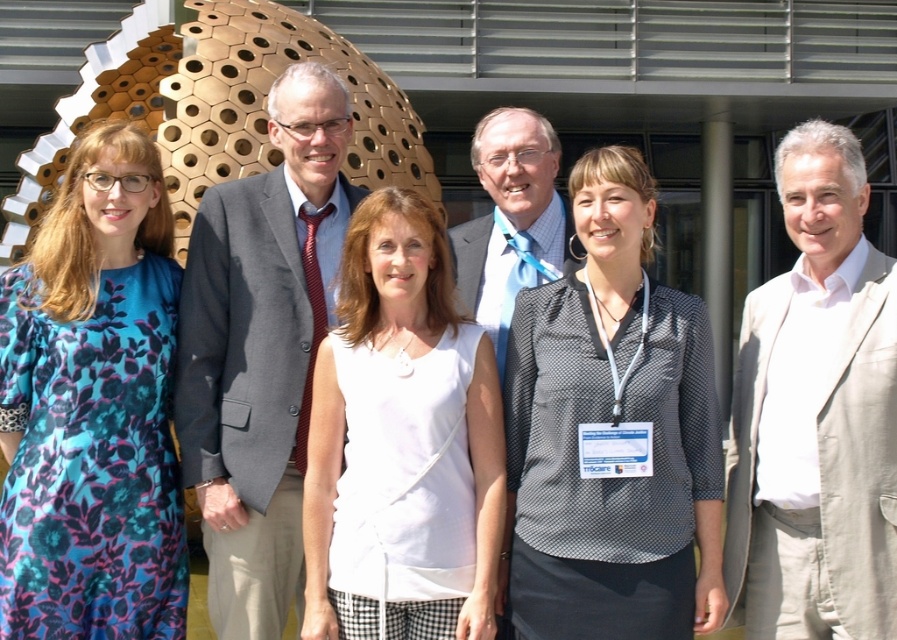
Can you confirm if polka dot blouse at center is positioned below light beige suit at center?

Yes.

Between polka dot blouse at center and light beige suit at center, which one is positioned higher?

light beige suit at center is higher up.

Is point (634, 605) more distant than point (873, 596)?

Yes, it is behind point (873, 596).

At what (x,y) coordinates should I click in order to perform the action: click on polka dot blouse at center. Please return your answer as a coordinate pair (x, y). This screenshot has height=640, width=897. Looking at the image, I should click on (610, 435).

Does point (366, 403) come farther from viewer compared to point (475, 262)?

No, it is not.

Find the location of a particular element. The image size is (897, 640). white fabric shirt at center is located at coordinates (402, 429).

Which is below, blue floral dress at left or light blue fabric at center?

blue floral dress at left is below.

Who is more distant from viewer, (84, 397) or (451, 237)?

Point (451, 237)

Which is in front, point (122, 248) or point (501, 262)?

Point (122, 248)

You are a GUI agent. You are given a task and a screenshot of the screen. Output one action in this format:
    pyautogui.click(x=<x>, y=<y>)
    Task: Click on the blue floral dress at left
    
    Given the screenshot: What is the action you would take?
    point(93,408)